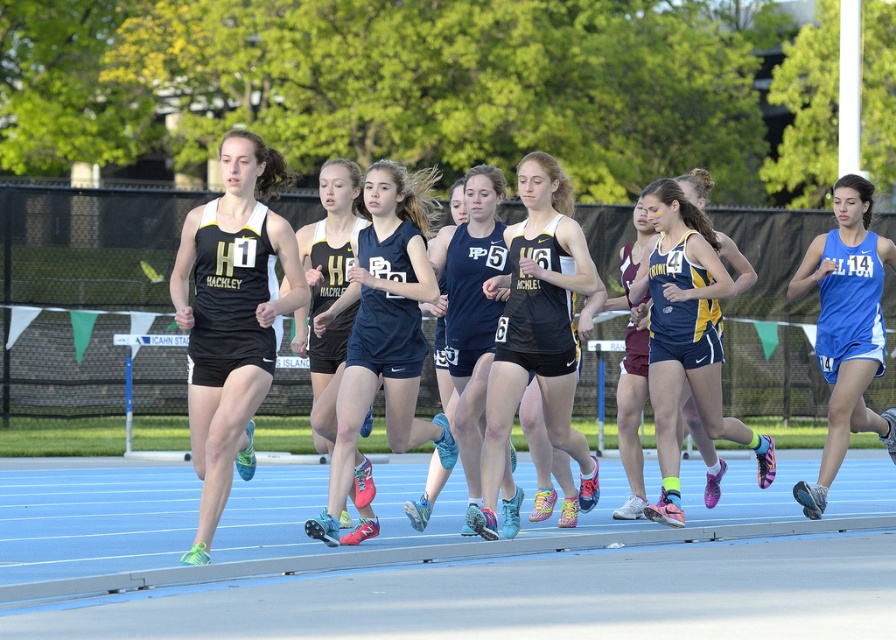
From the picture: You are a photographer positioned at the starting line of the track. You want to capture a photo that includes both the black matte tank top at center and the blue and yellow athletic uniform at center. Given that your camera has a maximum focus range of 4 meters, will both athletes be in focus?

The black matte tank top at center is 4.12 meters from the blue and yellow athletic uniform at center. Since the distance between them exceeds the camera focus range of 4 meters, both athletes may not be in focus simultaneously.

You are a photographer at the track race. You want to capture a photo of the black matte tank top at center and the blue and yellow athletic uniform at center. Which athlete should you focus on first to ensure both are in the frame?

The black matte tank top at center is in front of the blue and yellow athletic uniform at center, so you should focus on the black matte tank top at center first to ensure both are in the frame.

You are a photographer positioned at the starting line of the race. You need to capture a photo where both the black matte tank top at center and the blue and yellow athletic uniform at center are visible. Based on their positions, which athlete is closer to the camera?

The black matte tank top at center is taller than the blue and yellow athletic uniform at center, so the black matte tank top at center is closer to the camera.